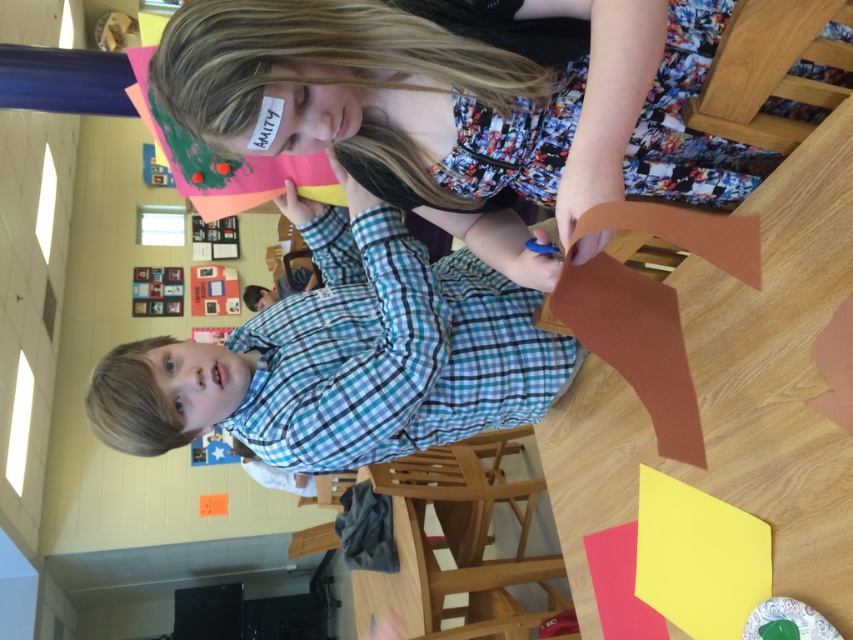
Question: Does matte paper at upper center lie in front of matte plaid shirt at center?

Choices:
 (A) yes
 (B) no

Answer: (A)

Question: Observing the image, what is the correct spatial positioning of matte paper at upper center in reference to matte plaid shirt at center?

Choices:
 (A) below
 (B) above

Answer: (B)

Question: Which point appears farthest from the camera in this image?

Choices:
 (A) (399, 150)
 (B) (357, 276)

Answer: (B)

Question: Does matte paper at upper center appear on the left side of matte plaid shirt at center?

Choices:
 (A) yes
 (B) no

Answer: (B)